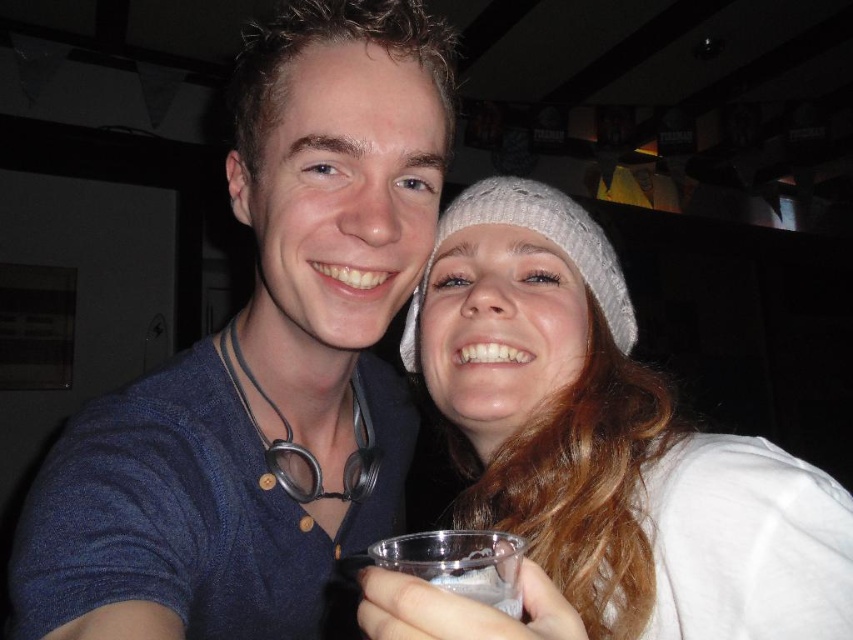
This screenshot has height=640, width=853. What do you see at coordinates (263, 360) in the screenshot?
I see `blue fabric shirt at center` at bounding box center [263, 360].

Which is behind, point (390, 36) or point (450, 579)?

Point (390, 36)

Image resolution: width=853 pixels, height=640 pixels. I want to click on blue fabric shirt at center, so click(263, 360).

This screenshot has width=853, height=640. What do you see at coordinates (599, 454) in the screenshot?
I see `white knit hat at upper right` at bounding box center [599, 454].

Who is higher up, white knit hat at upper right or clear plastic cup at lower center?

white knit hat at upper right

Image resolution: width=853 pixels, height=640 pixels. Identify the location of white knit hat at upper right. coord(599,454).

This screenshot has width=853, height=640. I want to click on white knit hat at upper right, so click(x=599, y=454).

Does blue fabric shirt at center appear under white knitted hat at upper right?

Yes, blue fabric shirt at center is below white knitted hat at upper right.

Who is shorter, blue fabric shirt at center or white knitted hat at upper right?

white knitted hat at upper right

Find the location of a particular element. blue fabric shirt at center is located at coordinates (263, 360).

You are a GUI agent. You are given a task and a screenshot of the screen. Output one action in this format:
    pyautogui.click(x=<x>, y=<y>)
    Task: Click on the blue fabric shirt at center
    This screenshot has width=853, height=640.
    Given the screenshot: What is the action you would take?
    pyautogui.click(x=263, y=360)